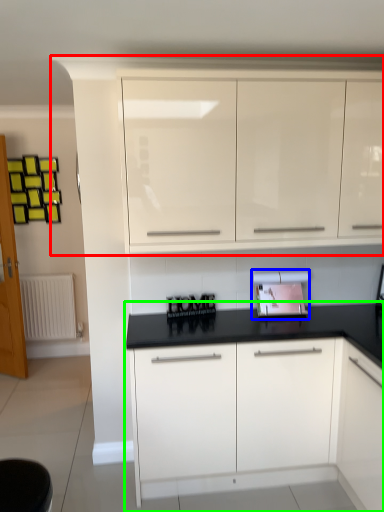
Question: Estimate the real-world distances between objects in this image. Which object is farther from cabinetry (highlighted by a red box), appliance (highlighted by a blue box) or cabinetry (highlighted by a green box)?

Choices:
 (A) appliance
 (B) cabinetry

Answer: (B)